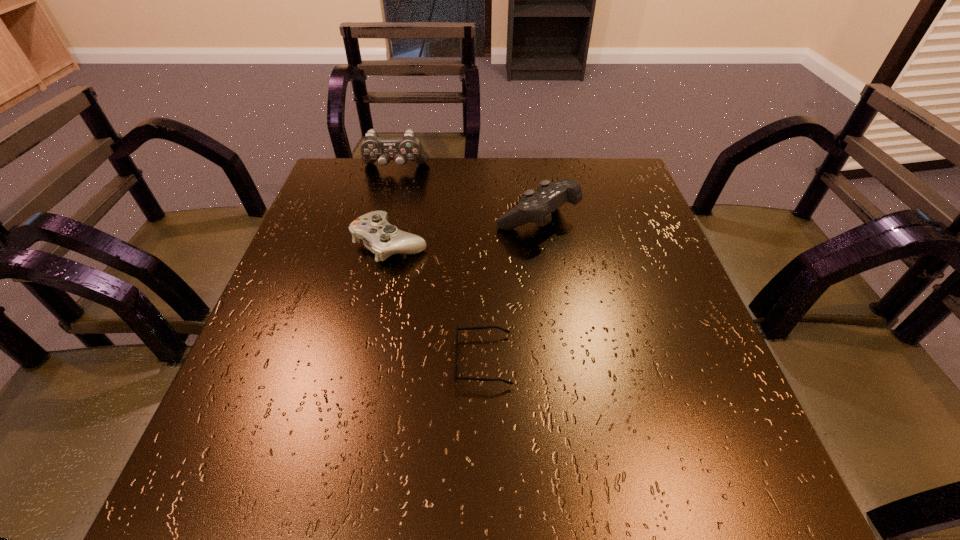
You are a GUI agent. You are given a task and a screenshot of the screen. Output one action in this format:
    pyautogui.click(x=<x>, y=<y>)
    Task: Click on the vacant region located on the front-facing side of the nearest object
    
    Given the screenshot: What is the action you would take?
    pyautogui.click(x=272, y=360)

Find the location of `free location located 0.270m on the front-facing side of the nearest object`. free location located 0.270m on the front-facing side of the nearest object is located at coordinates (305, 360).

Find the location of a particular element. The height and width of the screenshot is (540, 960). free region located on the front-facing side of the nearest object is located at coordinates (289, 360).

This screenshot has height=540, width=960. I want to click on object at the far left corner, so click(373, 148).

You are a GUI agent. You are given a task and a screenshot of the screen. Output one action in this format:
    pyautogui.click(x=<x>, y=<y>)
    Task: Click on the vacant position at the far edge of the desktop
    This screenshot has height=540, width=960.
    Given the screenshot: What is the action you would take?
    pyautogui.click(x=545, y=167)

In the image, there is a desktop. Identify the location of vacant space at the near edge. This screenshot has width=960, height=540. (382, 461).

Image resolution: width=960 pixels, height=540 pixels. I want to click on vacant space at the left edge, so click(x=328, y=228).

Image resolution: width=960 pixels, height=540 pixels. I want to click on blank area at the right edge, so click(623, 320).

This screenshot has width=960, height=540. I want to click on free spot at the far left corner of the desktop, so click(376, 207).

The height and width of the screenshot is (540, 960). In the image, there is a desktop. What are the coordinates of `free region at the far right corner` in the screenshot? It's located at (574, 171).